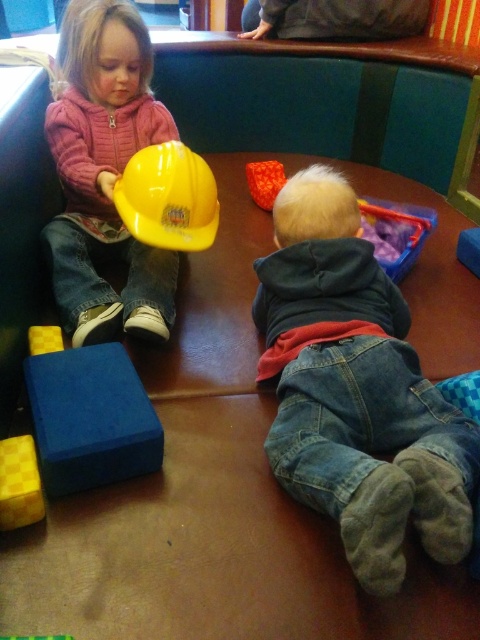
Question: Can you confirm if yellow hard hat at left is positioned to the left of rubber yellow construction helmet at upper left?

Choices:
 (A) no
 (B) yes

Answer: (A)

Question: Considering the real-world distances, which object is closest to the matte yellow hard hat at upper left?

Choices:
 (A) orange fabric toy at center
 (B) rubber yellow construction helmet at upper left
 (C) blue foam block at lower left
 (D) yellow hard hat at left

Answer: (D)

Question: Can you confirm if denim jeans at lower right is positioned above blue foam block at lower left?

Choices:
 (A) no
 (B) yes

Answer: (B)

Question: Which object appears closest to the camera in this image?

Choices:
 (A) denim jeans at lower right
 (B) orange fabric toy at center

Answer: (A)

Question: Can you confirm if yellow foam block at lower left is thinner than rubber yellow construction helmet at upper left?

Choices:
 (A) no
 (B) yes

Answer: (A)

Question: Which object appears farthest from the camera in this image?

Choices:
 (A) denim jeans at lower right
 (B) yellow foam block at lower left
 (C) blue foam block at lower left
 (D) matte yellow hard hat at upper left

Answer: (D)